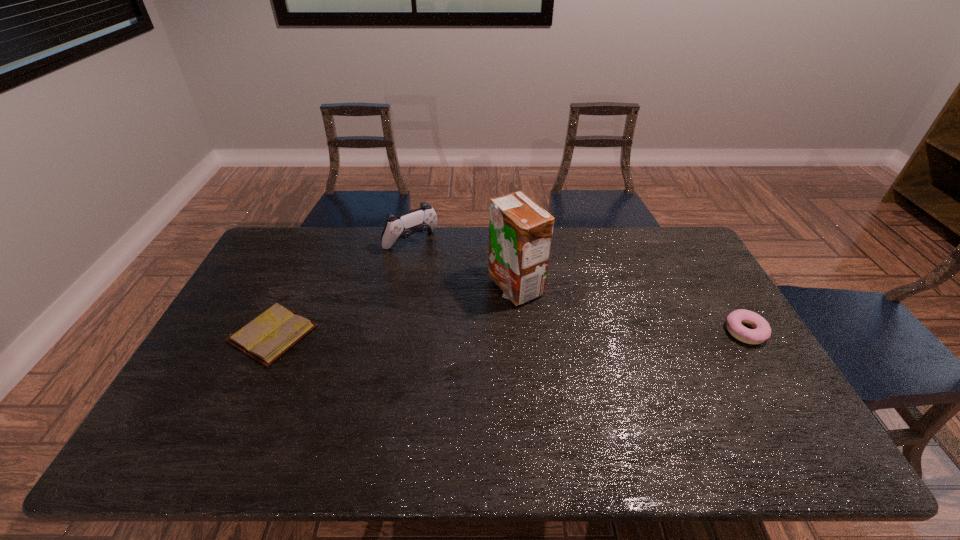
Find the location of a particular element. The height and width of the screenshot is (540, 960). diary is located at coordinates (266, 338).

Locate an element on the screen. the leftmost object is located at coordinates (266, 338).

The height and width of the screenshot is (540, 960). Find the location of `doughnut`. doughnut is located at coordinates (761, 331).

The width and height of the screenshot is (960, 540). I want to click on the rightmost object, so click(761, 331).

Locate an element on the screen. the third object from left to right is located at coordinates (520, 231).

Find the location of a particular element. The width and height of the screenshot is (960, 540). carton is located at coordinates (520, 231).

This screenshot has width=960, height=540. In order to click on the second object from left to right in this screenshot , I will do `click(423, 219)`.

Where is `control`? The width and height of the screenshot is (960, 540). control is located at coordinates (423, 219).

Image resolution: width=960 pixels, height=540 pixels. I want to click on vacant space situated 0.370m on the right of the leftmost object, so click(x=444, y=334).

Where is `free location located 0.110m on the back of the doughnut`? The image size is (960, 540). free location located 0.110m on the back of the doughnut is located at coordinates (722, 293).